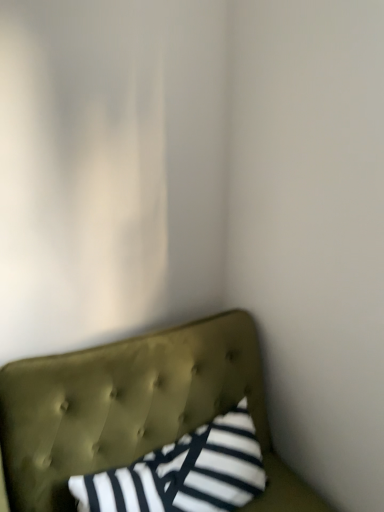
Question: Is tufted olive green headboard at lower left taller than striped fabric pillow at center?

Choices:
 (A) yes
 (B) no

Answer: (A)

Question: Is tufted olive green headboard at lower left closer to camera compared to striped fabric pillow at center?

Choices:
 (A) no
 (B) yes

Answer: (B)

Question: Can you confirm if tufted olive green headboard at lower left is smaller than striped fabric pillow at center?

Choices:
 (A) no
 (B) yes

Answer: (A)

Question: Can you confirm if tufted olive green headboard at lower left is positioned to the right of striped fabric pillow at center?

Choices:
 (A) no
 (B) yes

Answer: (B)

Question: From a real-world perspective, is tufted olive green headboard at lower left physically below striped fabric pillow at center?

Choices:
 (A) yes
 (B) no

Answer: (A)

Question: Is tufted olive green headboard at lower left positioned with its back to striped fabric pillow at center?

Choices:
 (A) yes
 (B) no

Answer: (A)

Question: Can you confirm if striped fabric pillow at center is thinner than tufted olive green headboard at lower left?

Choices:
 (A) yes
 (B) no

Answer: (A)

Question: Is striped fabric pillow at center positioned with its back to tufted olive green headboard at lower left?

Choices:
 (A) no
 (B) yes

Answer: (B)

Question: Does striped fabric pillow at center have a greater height compared to tufted olive green headboard at lower left?

Choices:
 (A) yes
 (B) no

Answer: (B)

Question: Is striped fabric pillow at center bigger than tufted olive green headboard at lower left?

Choices:
 (A) yes
 (B) no

Answer: (B)

Question: From the image's perspective, is striped fabric pillow at center under tufted olive green headboard at lower left?

Choices:
 (A) yes
 (B) no

Answer: (B)

Question: Considering the relative positions of striped fabric pillow at center and tufted olive green headboard at lower left in the image provided, is striped fabric pillow at center to the right of tufted olive green headboard at lower left from the viewer's perspective?

Choices:
 (A) yes
 (B) no

Answer: (B)

Question: Looking at the image, does tufted olive green headboard at lower left seem bigger or smaller compared to striped fabric pillow at center?

Choices:
 (A) big
 (B) small

Answer: (A)